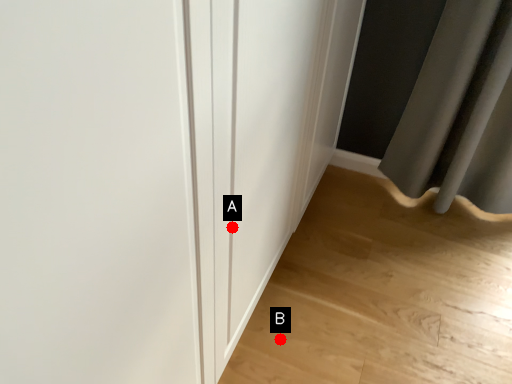
Question: Two points are circled on the image, labeled by A and B beside each circle. Which point is further to the camera?

Choices:
 (A) A is further
 (B) B is further

Answer: (B)